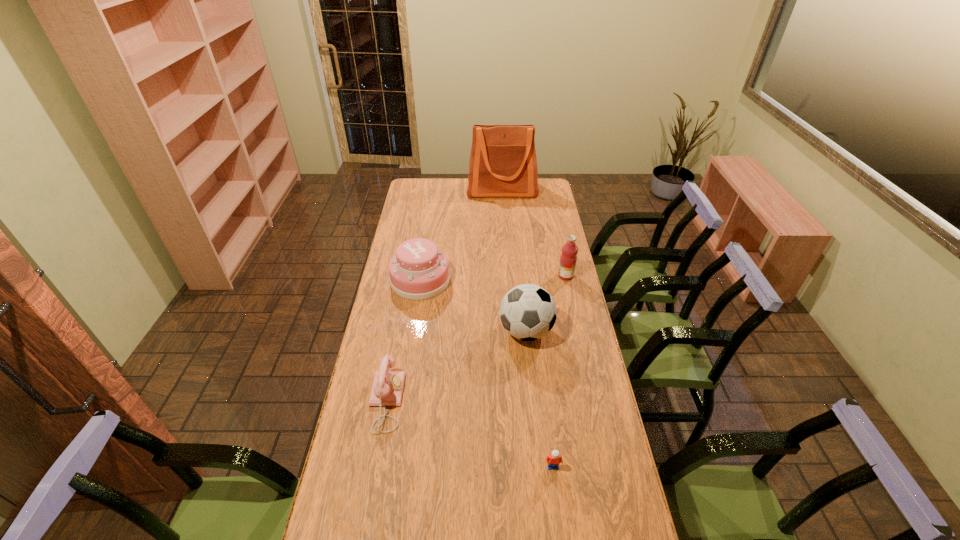
Find the location of `free location located on the main logo of the soccer ball`. free location located on the main logo of the soccer ball is located at coordinates (449, 332).

In order to click on vacant area situated on the main logo of the soccer ball in this screenshot , I will do `click(475, 332)`.

Locate an element on the screen. vacant point located 0.380m on the main logo of the soccer ball is located at coordinates (399, 332).

Locate an element on the screen. blank space located 0.080m on the label of the rightmost object is located at coordinates (540, 276).

Identify the location of free space located 0.190m on the label of the rightmost object. This screenshot has height=540, width=960. (515, 276).

Locate an element on the screen. The height and width of the screenshot is (540, 960). vacant space positioned 0.350m on the label of the rightmost object is located at coordinates (478, 276).

This screenshot has width=960, height=540. I want to click on free spot located 0.300m on the front of the fourth tallest object, so click(408, 359).

Find the location of a particular element. This screenshot has width=960, height=540. vacant space situated 0.240m on the dial of the fifth tallest object is located at coordinates (475, 401).

Image resolution: width=960 pixels, height=540 pixels. Find the location of `free space located on the face of the shortest object`. free space located on the face of the shortest object is located at coordinates (559, 514).

This screenshot has width=960, height=540. What are the coordinates of `object at the far edge` in the screenshot? It's located at (503, 163).